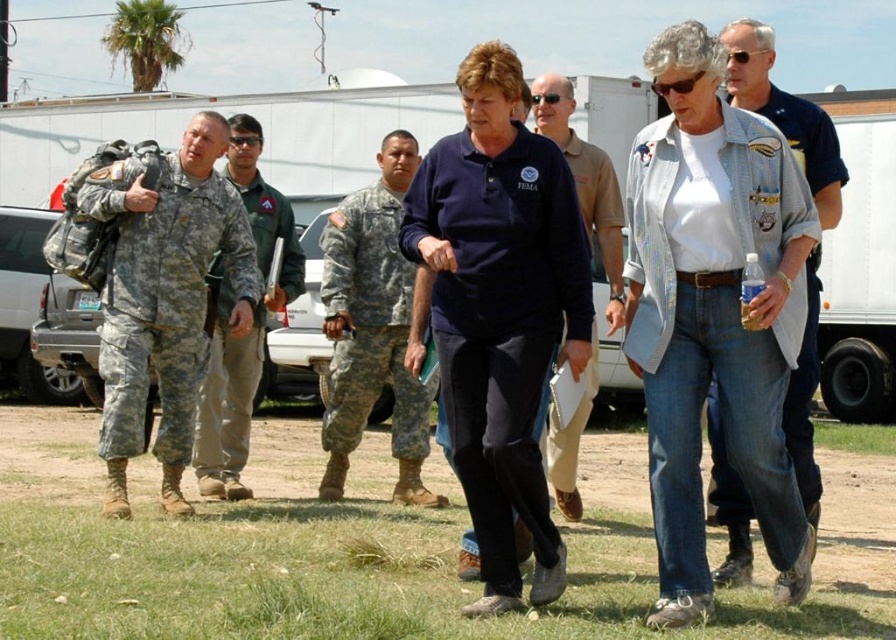
You are a photographer trying to capture a photo of the two men in camouflage uniforms. The camouflage fabric uniform at left and the camouflage uniform at center are both in your viewfinder. According to the scene description, which camouflage uniform is positioned higher in the frame?

The camouflage fabric uniform at left is positioned higher in the frame than the camouflage uniform at center.

You are a photographer trying to capture a photo of the navy blue cotton shirt at center and the camouflage uniform at left. Based on their positions, which one should you focus on first to ensure both are in frame?

The navy blue cotton shirt at center is below the camouflage uniform at left, so you should focus on the camouflage uniform at left first to ensure both are in frame.

You are standing at the point labeled point (x=186, y=618) and want to walk to the point labeled point (x=631, y=208). Which direction should you move in relation to the two women walking in the foreground?

You should move away from the two women walking in the foreground because point (x=631, y=208) is farther from the viewer compared to point (x=186, y=618).